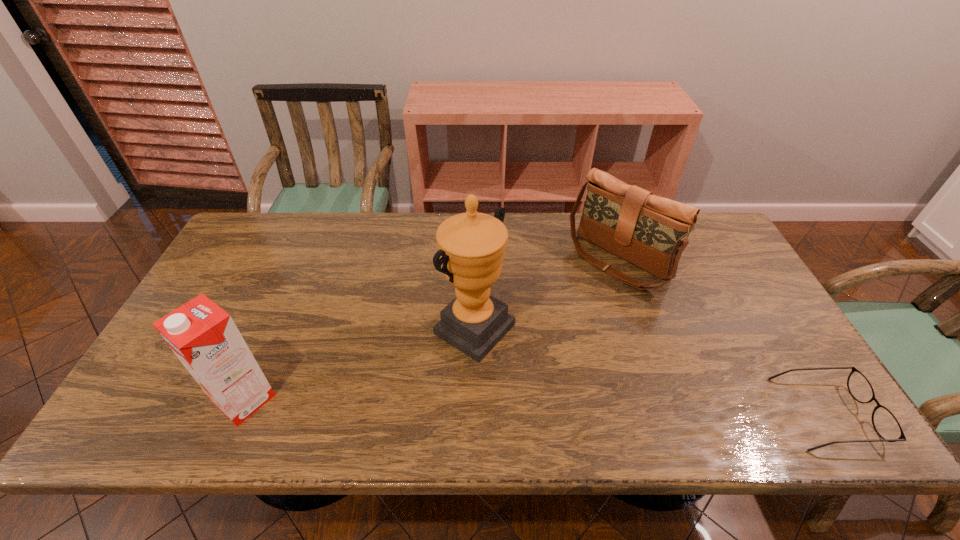
Where is `vacant space on the desktop that is between the third shortest object and the spectacles and is positioned at the front of the tallest object with handles`? The height and width of the screenshot is (540, 960). vacant space on the desktop that is between the third shortest object and the spectacles and is positioned at the front of the tallest object with handles is located at coordinates (605, 408).

Locate an element on the screen. This screenshot has height=540, width=960. vacant space on the desktop that is between the second tallest object and the spectacles and is positioned on the front-facing side of the second shortest object is located at coordinates point(461,404).